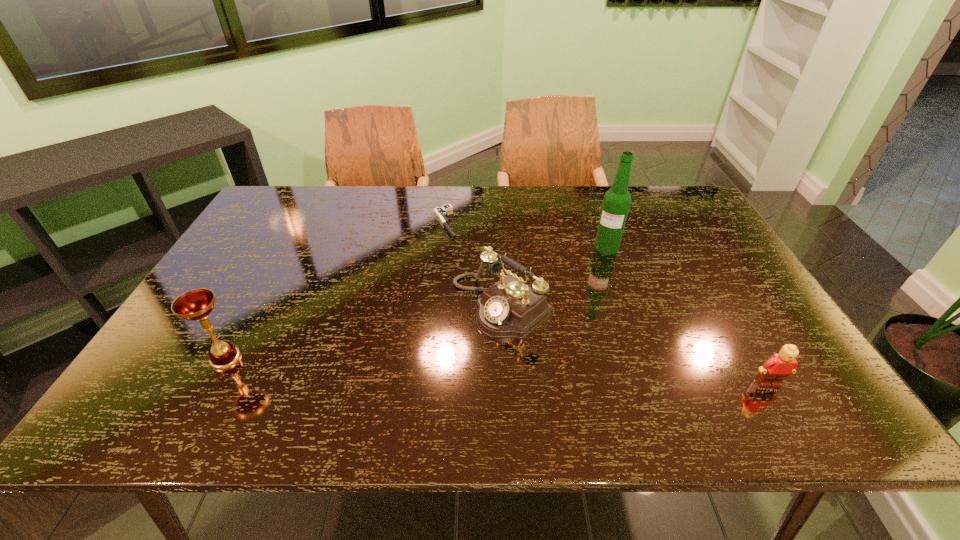
Image resolution: width=960 pixels, height=540 pixels. I want to click on free space between the shortest object and the Lego, so click(607, 303).

Find the location of `vacant region between the leftmost object and the third farthest object`. vacant region between the leftmost object and the third farthest object is located at coordinates (364, 332).

Locate an element on the screen. unoccupied area between the pistol and the second object from right to left is located at coordinates (526, 235).

Locate an element on the screen. This screenshot has height=540, width=960. free space between the chalice and the third nearest object is located at coordinates (364, 332).

Locate which object ranks second in proximity to the third nearest object. Please provide its 2D coordinates. Your answer should be formatted as a tuple, i.e. [(x, y)], where the tuple contains the x and y coordinates of a point satisfying the conditions above.

[(617, 200)]

Locate which object is the closest to the pistol. Please provide its 2D coordinates. Your answer should be formatted as a tuple, i.e. [(x, y)], where the tuple contains the x and y coordinates of a point satisfying the conditions above.

[(510, 308)]

Locate an element on the screen. free point that satisfies the following two spatial constraints: 1. on the front side of the fourth nearest object; 2. on the right side of the pistol is located at coordinates (443, 247).